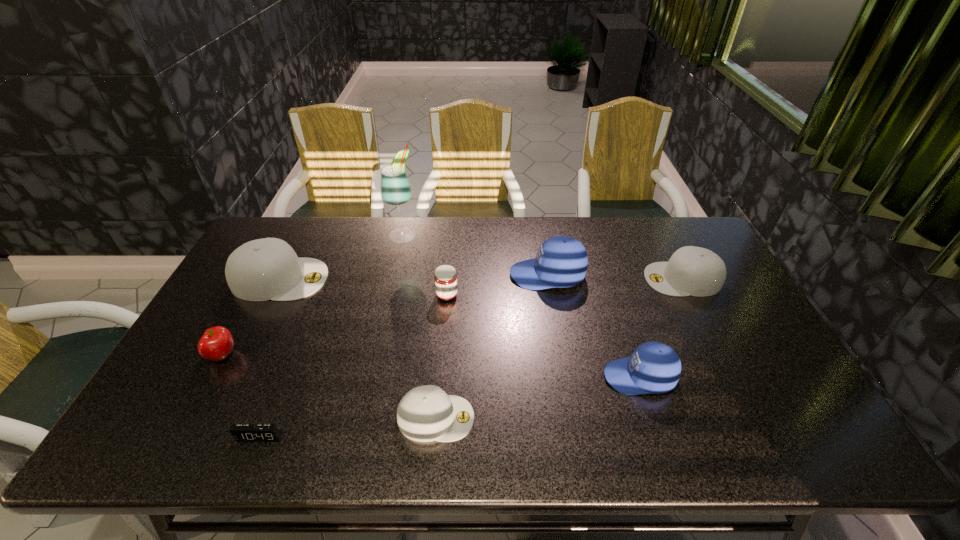
Locate an element on the screen. the second gray cap from left to right is located at coordinates (426, 413).

Image resolution: width=960 pixels, height=540 pixels. What are the coordinates of `the fourth cap from right to left` in the screenshot? It's located at (426, 413).

Where is `alarm clock`? alarm clock is located at coordinates (241, 432).

I want to click on free space located 0.270m on the front of the tallest object, so click(390, 300).

Identify the location of free space located on the front-facing side of the bigger blue cap. This screenshot has height=540, width=960. (454, 275).

Locate an element on the screen. The width and height of the screenshot is (960, 540). vacant region located 0.220m on the front-facing side of the bigger blue cap is located at coordinates pyautogui.click(x=442, y=275).

I want to click on vacant space positioned on the front-facing side of the bigger blue cap, so click(x=429, y=275).

Where is `vacant space located on the front-facing side of the biggest gray cap`? vacant space located on the front-facing side of the biggest gray cap is located at coordinates (352, 279).

You are a GUI agent. You are given a task and a screenshot of the screen. Output one action in this format:
    pyautogui.click(x=<x>, y=<y>)
    Task: Click on the free location located on the front-facing side of the rightmost gray cap
    The image size is (960, 540).
    Given the screenshot: What is the action you would take?
    pyautogui.click(x=630, y=279)

The height and width of the screenshot is (540, 960). I want to click on vacant space located on the front-facing side of the rightmost gray cap, so click(519, 279).